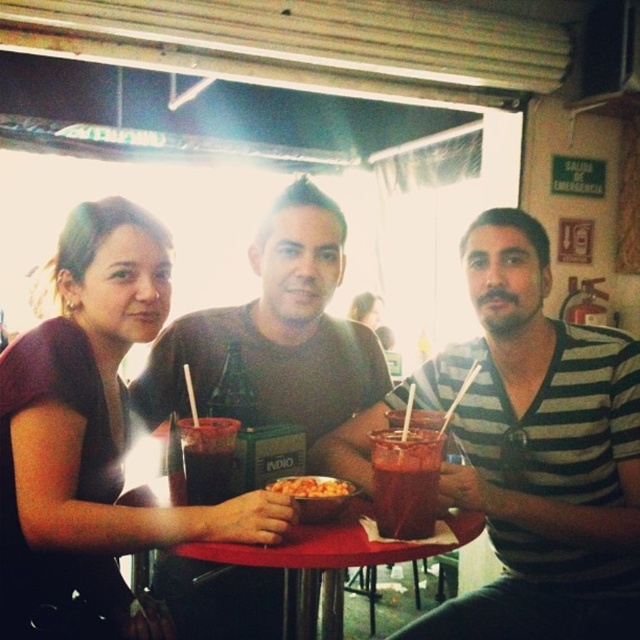
You are a server at a restaurant and need to place a new dish on the table. The dish is too heavy to lift, so you must slide it across the table. The dish is currently on the shiny plastic bowl of pasta at center. Which direction should you push it to move it onto the red plastic table at center?

The red plastic table at center is below the shiny plastic bowl of pasta at center, so you should push the dish downward to move it onto the red plastic table at center.

You are a photographer taking a picture of the matte brown shirt at center and the dark red glass at center. Which object should you focus on first if you want to ensure both are in focus?

The matte brown shirt at center is taller than the dark red glass at center, so focusing on the matte brown shirt at center first will help ensure both are in focus.